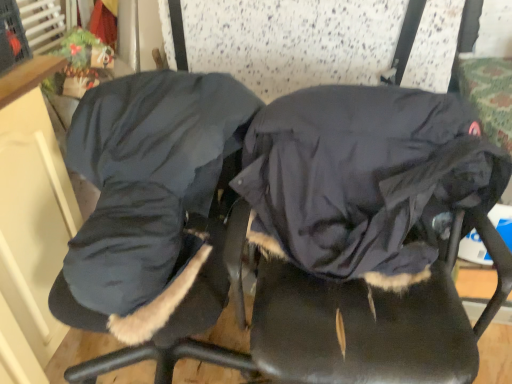
What do you see at coordinates (148, 180) in the screenshot? The image size is (512, 384). I see `dark gray fabric coat at center` at bounding box center [148, 180].

The image size is (512, 384). What do you see at coordinates (357, 236) in the screenshot?
I see `velvet-like dark blue coat at center` at bounding box center [357, 236].

This screenshot has height=384, width=512. I want to click on velvet-like dark blue coat at center, so click(x=357, y=236).

Where is `dark gray fabric coat at center`? dark gray fabric coat at center is located at coordinates (148, 180).

Which object is further away from the camera, dark gray fabric coat at center or dark blue fleece sleeping bag at center?

dark blue fleece sleeping bag at center is more distant.

Is dark gray fabric coat at center facing towards dark blue fleece sleeping bag at center?

No, dark gray fabric coat at center is not aimed at dark blue fleece sleeping bag at center.

Is dark gray fabric coat at center touching dark blue fleece sleeping bag at center?

They are not placed beside each other.

Find the location of a particular element. Image resolution: width=512 pixels, height=384 pixels. sleeping bag that is on the right side of dark gray fabric coat at center is located at coordinates (361, 177).

Looking at this image, is dark blue fleece sleeping bag at center oriented towards velvet-like dark blue coat at center?

Yes, dark blue fleece sleeping bag at center is aimed at velvet-like dark blue coat at center.

Considering the positions of objects dark blue fleece sleeping bag at center and velvet-like dark blue coat at center in the image provided, who is more to the right, dark blue fleece sleeping bag at center or velvet-like dark blue coat at center?

dark blue fleece sleeping bag at center is more to the right.

Where is `sleeping bag positioned vertically above the velvet-like dark blue coat at center (from a real-world perspective)`? The height and width of the screenshot is (384, 512). sleeping bag positioned vertically above the velvet-like dark blue coat at center (from a real-world perspective) is located at coordinates tap(361, 177).

Are dark blue fleece sleeping bag at center and velvet-like dark blue coat at center beside each other?

Yes, dark blue fleece sleeping bag at center is beside velvet-like dark blue coat at center.

Is velvet-like dark blue coat at center not within dark blue fleece sleeping bag at center?

Yes, velvet-like dark blue coat at center is not within dark blue fleece sleeping bag at center.

Which object is thinner, velvet-like dark blue coat at center or dark blue fleece sleeping bag at center?

With smaller width is dark blue fleece sleeping bag at center.

Considering the positions of objects velvet-like dark blue coat at center and dark blue fleece sleeping bag at center in the image provided, who is more to the right, velvet-like dark blue coat at center or dark blue fleece sleeping bag at center?

dark blue fleece sleeping bag at center is more to the right.

Could you tell me if velvet-like dark blue coat at center is facing dark blue fleece sleeping bag at center?

No, velvet-like dark blue coat at center is not turned towards dark blue fleece sleeping bag at center.

Does dark gray fabric coat at center contain velvet-like dark blue coat at center?

Actually, velvet-like dark blue coat at center is outside dark gray fabric coat at center.

Who is shorter, dark gray fabric coat at center or velvet-like dark blue coat at center?

With less height is dark gray fabric coat at center.

Looking at this image, from the image's perspective, is dark gray fabric coat at center located beneath velvet-like dark blue coat at center?

Actually, dark gray fabric coat at center appears above velvet-like dark blue coat at center in the image.

Locate an element on the screen. chair below the dark gray fabric coat at center (from the image's perspective) is located at coordinates (357, 236).

Can you tell me how much dark blue fleece sleeping bag at center and dark gray fabric coat at center differ in facing direction?

2.77 degrees.

Does dark blue fleece sleeping bag at center come behind dark gray fabric coat at center?

Yes.

From the image's perspective, is dark blue fleece sleeping bag at center above dark gray fabric coat at center?

No.

Which object is more forward, velvet-like dark blue coat at center or dark gray fabric coat at center?

velvet-like dark blue coat at center is in front.

Does velvet-like dark blue coat at center have a smaller size compared to dark gray fabric coat at center?

Incorrect, velvet-like dark blue coat at center is not smaller in size than dark gray fabric coat at center.

From a real-world perspective, relative to dark gray fabric coat at center, is velvet-like dark blue coat at center vertically above or below?

In terms of real-world spatial position, velvet-like dark blue coat at center is below dark gray fabric coat at center.

Locate an element on the screen. clothing in front of the dark blue fleece sleeping bag at center is located at coordinates (148, 180).

What are the coordinates of `chair on the left of dark blue fleece sleeping bag at center` in the screenshot? It's located at (357, 236).

Looking at this image, based on their spatial positions, is velvet-like dark blue coat at center or dark blue fleece sleeping bag at center closer to dark gray fabric coat at center?

Among the two, dark blue fleece sleeping bag at center is located nearer to dark gray fabric coat at center.

Estimate the real-world distances between objects in this image. Which object is closer to dark blue fleece sleeping bag at center, dark gray fabric coat at center or velvet-like dark blue coat at center?

Among the two, velvet-like dark blue coat at center is located nearer to dark blue fleece sleeping bag at center.

Estimate the real-world distances between objects in this image. Which object is further from velvet-like dark blue coat at center, dark gray fabric coat at center or dark blue fleece sleeping bag at center?

dark gray fabric coat at center.

Looking at the image, which one is located further to velvet-like dark blue coat at center, dark blue fleece sleeping bag at center or dark gray fabric coat at center?

dark gray fabric coat at center is positioned further to the anchor velvet-like dark blue coat at center.

From the picture: Considering their positions, is velvet-like dark blue coat at center positioned closer to dark blue fleece sleeping bag at center than dark gray fabric coat at center?

Among the two, velvet-like dark blue coat at center is located nearer to dark blue fleece sleeping bag at center.

When comparing their distances from dark gray fabric coat at center, does dark blue fleece sleeping bag at center or velvet-like dark blue coat at center seem closer?

dark blue fleece sleeping bag at center.

Locate an element on the screen. chair between dark gray fabric coat at center and dark blue fleece sleeping bag at center in the horizontal direction is located at coordinates (357, 236).